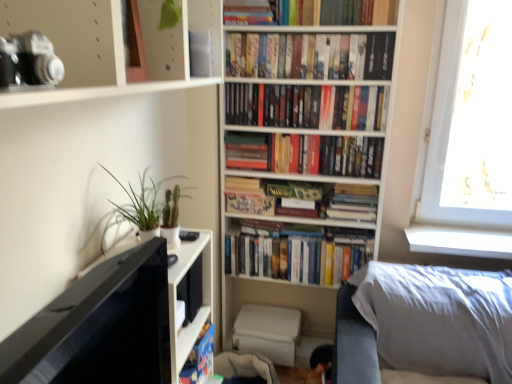
Question: Should I look upward or downward to see green matte plant at left?

Choices:
 (A) down
 (B) up

Answer: (A)

Question: Is white matte bookshelf at center at the back of hardcover books at center, which ranks as the 3th book in bottom-to-top order?

Choices:
 (A) no
 (B) yes

Answer: (B)

Question: From a real-world perspective, is hardcover books at center, which ranks as the third book in top-to-bottom order, physically above white matte bookshelf at center?

Choices:
 (A) yes
 (B) no

Answer: (A)

Question: Could you tell me if hardcover books at center, which ranks as the 3th book in bottom-to-top order, is turned towards white matte bookshelf at center?

Choices:
 (A) no
 (B) yes

Answer: (B)

Question: Is hardcover books at center, which ranks as the 3th book in bottom-to-top order, bigger than white matte bookshelf at center?

Choices:
 (A) no
 (B) yes

Answer: (A)

Question: Considering the relative positions of hardcover books at center, which ranks as the 3th book in bottom-to-top order, and white matte bookshelf at center in the image provided, is hardcover books at center, which ranks as the 3th book in bottom-to-top order, to the left of white matte bookshelf at center from the viewer's perspective?

Choices:
 (A) no
 (B) yes

Answer: (A)

Question: From the image's perspective, is hardcover books at upper center, the 1th book from the top, beneath white soft pillow at lower right?

Choices:
 (A) no
 (B) yes

Answer: (A)

Question: Is hardcover books at upper center, the 1th book from the top, far away from white soft pillow at lower right?

Choices:
 (A) no
 (B) yes

Answer: (B)

Question: Is hardcover books at upper center, the fifth book ordered from the bottom, positioned before white soft pillow at lower right?

Choices:
 (A) yes
 (B) no

Answer: (B)

Question: From a real-world perspective, is hardcover books at upper center, the fifth book ordered from the bottom, positioned over white soft pillow at lower right based on gravity?

Choices:
 (A) no
 (B) yes

Answer: (B)

Question: Considering the relative sizes of hardcover books at upper center, the fifth book ordered from the bottom, and white soft pillow at lower right in the image provided, is hardcover books at upper center, the fifth book ordered from the bottom, thinner than white soft pillow at lower right?

Choices:
 (A) no
 (B) yes

Answer: (B)

Question: Is hardcover books at upper center, the 1th book from the top, positioned beyond the bounds of white soft pillow at lower right?

Choices:
 (A) yes
 (B) no

Answer: (A)

Question: From the image's perspective, would you say hardcover book at center, the 1th paperback book viewed from the right, is positioned over green matte plant at left?

Choices:
 (A) yes
 (B) no

Answer: (A)